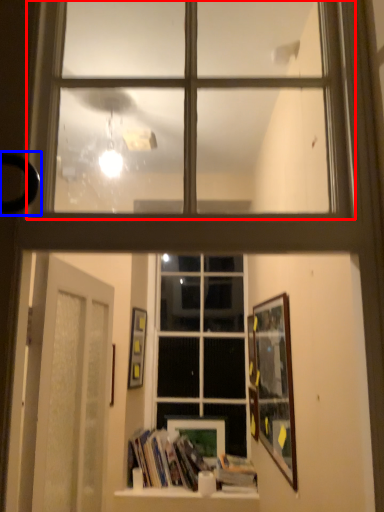
Question: Among these objects, which one is nearest to the camera, window (highlighted by a red box) or door handle (highlighted by a blue box)?

Choices:
 (A) window
 (B) door handle

Answer: (B)